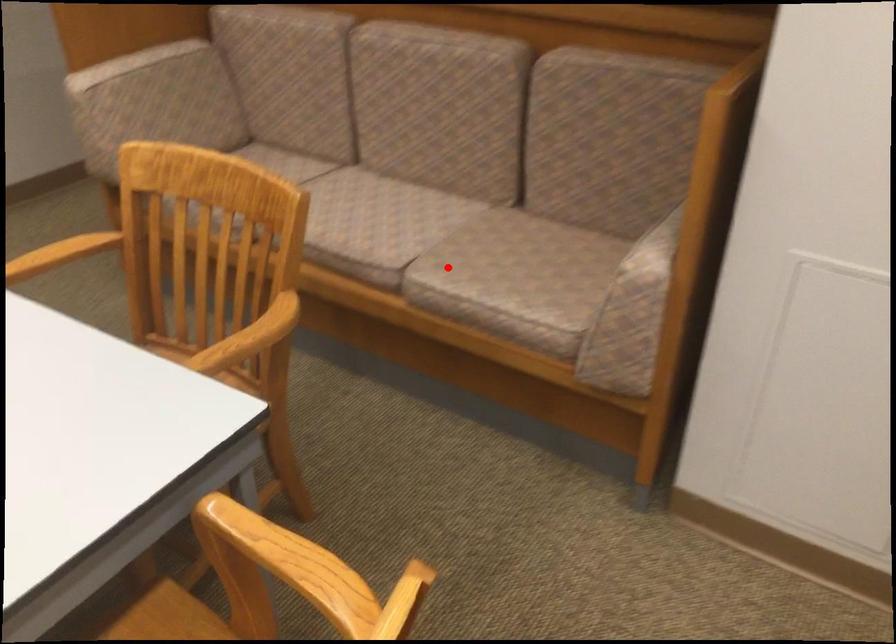
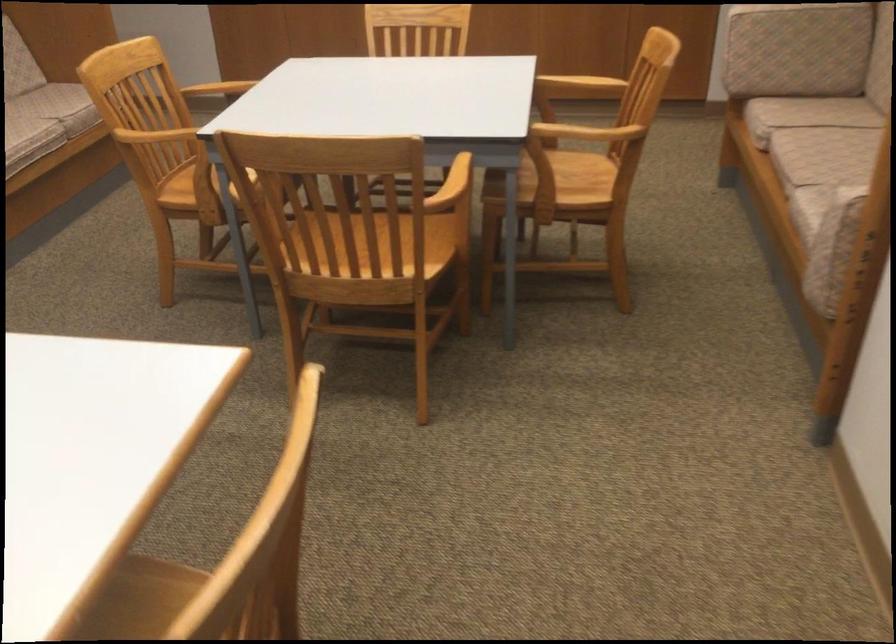
The point at the highlighted location is marked in the first image. Where is the corresponding point in the second image?

(822, 190)